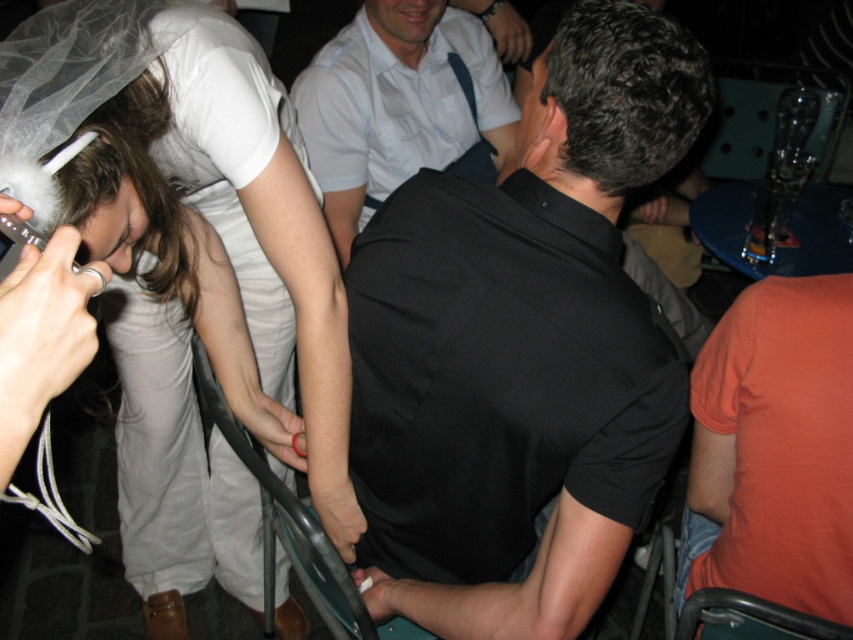
You are standing at the point marked as point [608,48]. You want to hand a small gift to the woman in the white outfit without disturbing the man in the black shirt. Can you do this while keeping at least 1 meter away from him?

The distance between you at point [608,48] and the man in the black shirt is 79.93 centimeters. Since you need to stay at least 1 meter away from him, you cannot hand the gift to the woman in the white outfit while maintaining that distance.